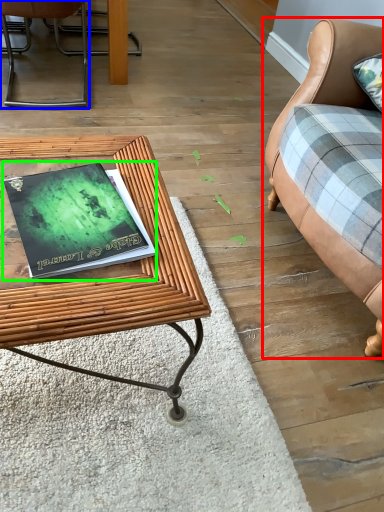
Question: Estimate the real-world distances between objects in this image. Which object is closer to studio couch (highlighted by a red box), chair (highlighted by a blue box) or paperback book (highlighted by a green box)?

Choices:
 (A) chair
 (B) paperback book

Answer: (B)